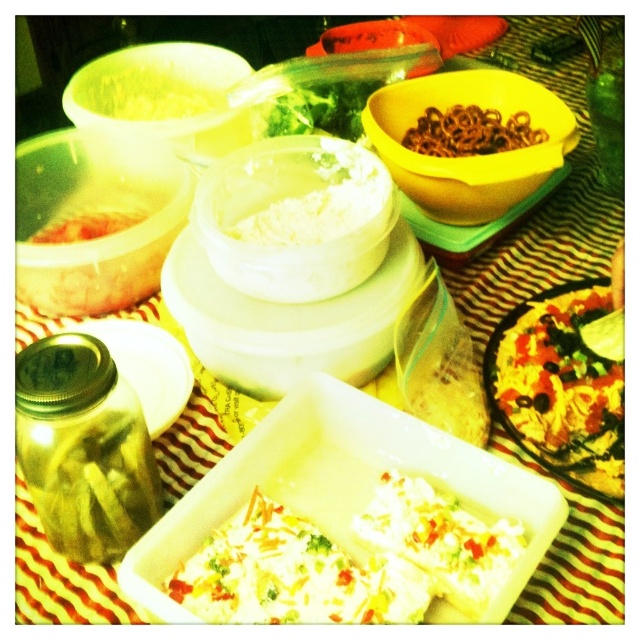
Question: Can you confirm if tomato sauce pizza at right is positioned below white powdery substance at center?

Choices:
 (A) yes
 (B) no

Answer: (A)

Question: Which of the following is the farthest from the observer?

Choices:
 (A) (236, 577)
 (B) (388, 35)
 (C) (424, 128)

Answer: (B)

Question: Based on their relative distances, which object is farther from the white powdery substance at center?

Choices:
 (A) smooth orange cheese at center
 (B) translucent plastic container at center

Answer: (B)

Question: Is white creamy salad at center below brown crunchy pretzels at upper center?

Choices:
 (A) no
 (B) yes

Answer: (B)

Question: Does tomato sauce pizza at right have a smaller size compared to yellow matte bowl at center?

Choices:
 (A) no
 (B) yes

Answer: (B)

Question: Which of these objects is positioned closest to the white powdery substance at center?

Choices:
 (A) translucent plastic container at center
 (B) tomato sauce pizza at right
 (C) yellow matte bowl at center

Answer: (C)